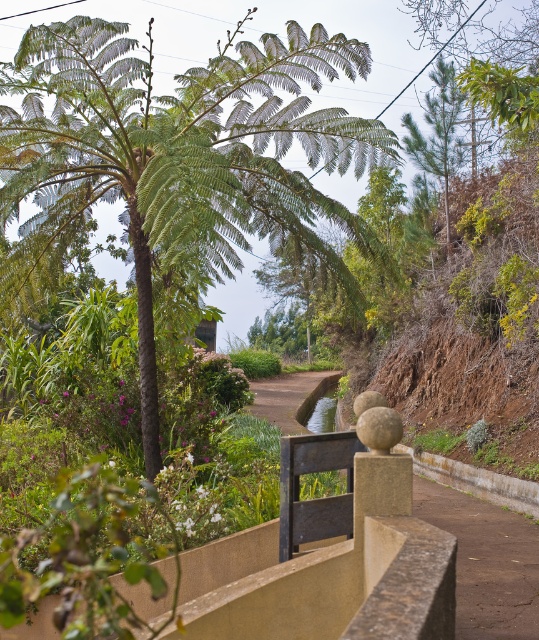
You are a gardener planning to plant a new tree in the garden. The green leafy palm tree at center and the brown dirt path at center are both in your view. Which object takes up more space in the scene?

The green leafy palm tree at center is larger in size than the brown dirt path at center, so it takes up more space in the scene.

You are standing at the entrance of the garden and want to locate the green leafy palm tree at center. According to the coordinates provided, where should you look relative to your position?

The green leafy palm tree at center is located at coordinates point (183, 154), which means it is positioned to the left and slightly above your current viewpoint.

You are planning to install a new pathway in the garden. The existing brown dirt path at center is currently narrower than the green leafy palm tree at center. If you want the new path to be wider than the palm tree, how should you adjust its width compared to the existing path?

The green leafy palm tree at center is wider than the brown dirt path at center. To make the new path wider than the palm tree, you need to increase its width beyond the current path, which is narrower than the tree.